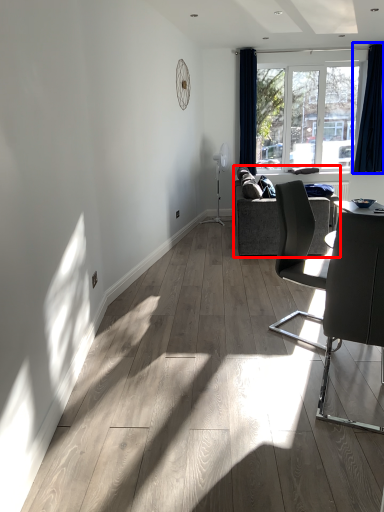
Question: Which point is closer to the camera, studio couch (highlighted by a red box) or curtain (highlighted by a blue box)?

Choices:
 (A) studio couch
 (B) curtain

Answer: (A)